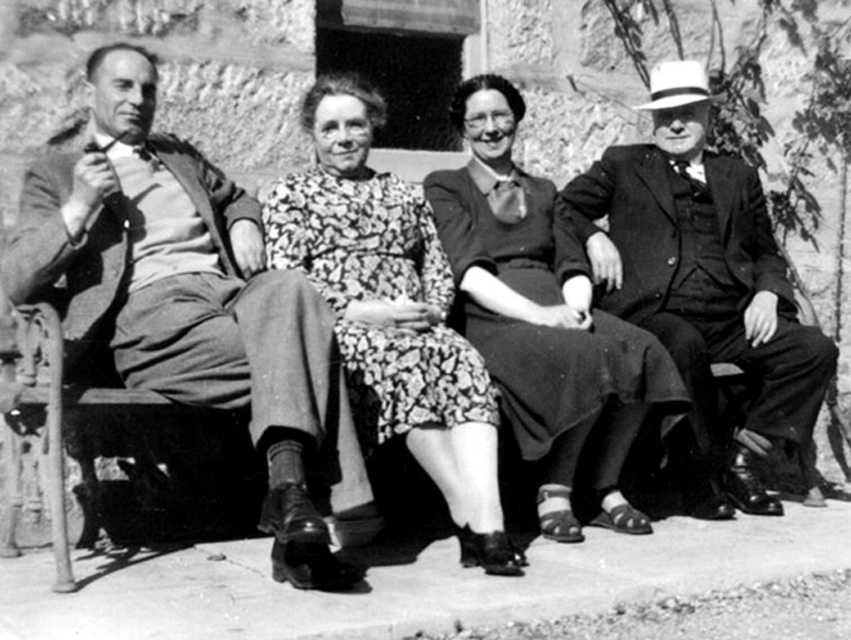
Based on the scene described, which object is wider, the smooth fabric suit at left or the smooth black suit at right?

The smooth fabric suit at left is wider than the smooth black suit at right according to the description.

Looking at this image, you are standing in front of the photograph and notice two points marked on it. One is at coordinates point (x=24, y=292) and the other at point (x=632, y=234). Which point is nearer to you?

Point (x=24, y=292) is closer to the viewer than point (x=632, y=234).

Based on the scene description, where is the smooth black suit at right located in the image?

The smooth black suit at right is located at point 0.434 on the x axis and 0.828 on the y axis.